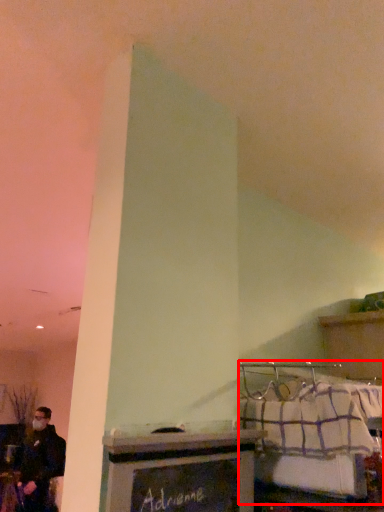
Question: From the image's perspective, what is the correct spatial positioning of bed (annotated by the red box) in reference to furniture?

Choices:
 (A) above
 (B) below

Answer: (A)